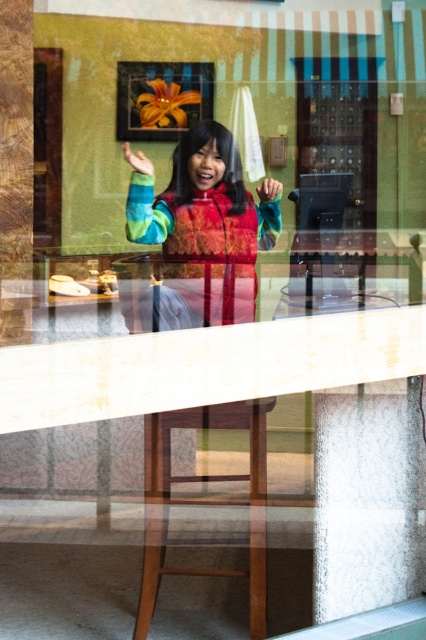
Does brown wooden stool at lower center have a larger size compared to green matte hand at center?

Yes, brown wooden stool at lower center is bigger than green matte hand at center.

Can you confirm if brown wooden stool at lower center is wider than green matte hand at center?

Correct, the width of brown wooden stool at lower center exceeds that of green matte hand at center.

Who is more distant from viewer, (x=215, y=480) or (x=141, y=160)?

The point (x=215, y=480) is more distant.

I want to click on brown wooden stool at lower center, so click(x=203, y=499).

Does multicolored fleece jacket at center lie behind green matte hand at center?

That is False.

Where is `multicolored fleece jacket at center`? Image resolution: width=426 pixels, height=640 pixels. multicolored fleece jacket at center is located at coordinates (206, 228).

Is transparent glass door at center below brown wooden stool at lower center?

No, transparent glass door at center is not below brown wooden stool at lower center.

Can you confirm if transparent glass door at center is positioned above brown wooden stool at lower center?

Yes.

Is point (373, 170) positioned in front of point (150, 456)?

No, (373, 170) is behind (150, 456).

This screenshot has height=640, width=426. I want to click on transparent glass door at center, so click(x=339, y=150).